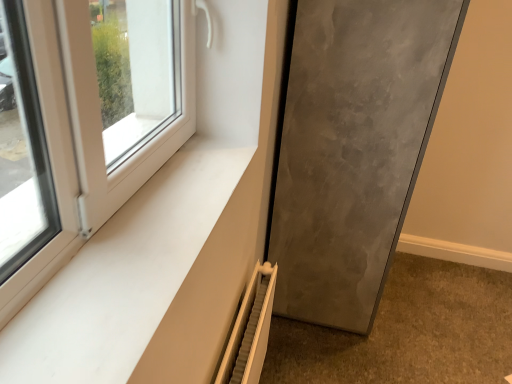
The height and width of the screenshot is (384, 512). Find the location of `free space above white matte window sill at lower left (from a real-world perspective)`. free space above white matte window sill at lower left (from a real-world perspective) is located at coordinates (151, 223).